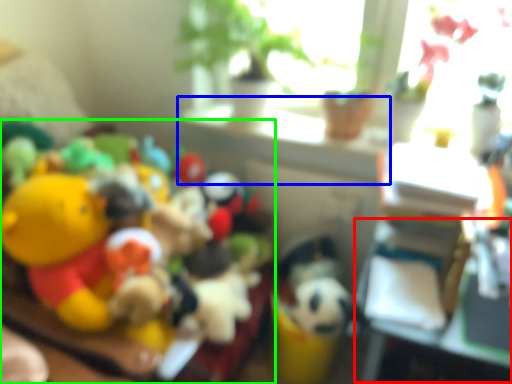
Question: Estimate the real-world distances between objects in this image. Which object is closer to table (highlighted by a red box), window sill (highlighted by a blue box) or toy (highlighted by a green box)?

Choices:
 (A) window sill
 (B) toy

Answer: (A)